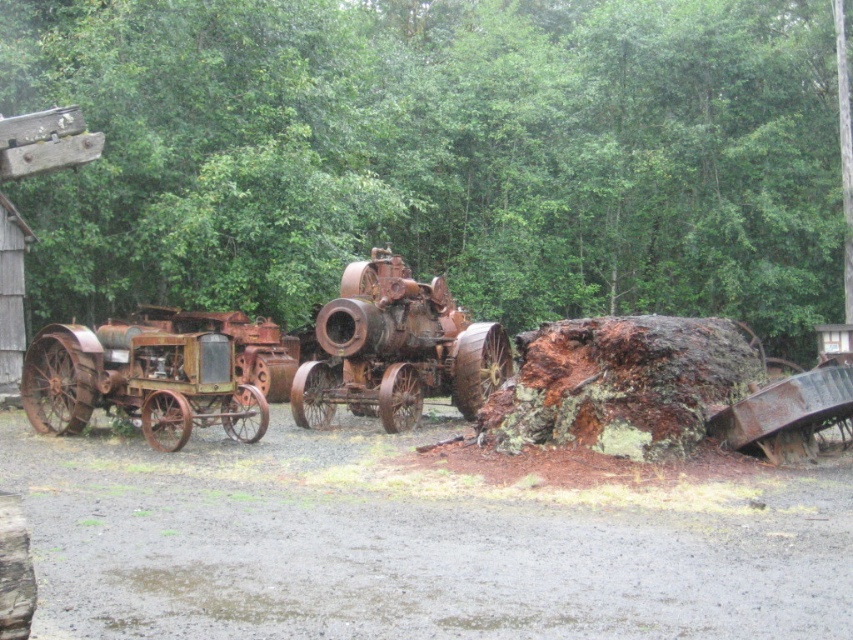
Question: Can you confirm if green leafy tree at upper center is positioned to the left of rusty metal tractor at left?

Choices:
 (A) yes
 (B) no

Answer: (B)

Question: Is green leafy tree at upper center to the left of rusty metal tractor at left from the viewer's perspective?

Choices:
 (A) yes
 (B) no

Answer: (B)

Question: Does green leafy tree at upper center come in front of rusty metal tractor at left?

Choices:
 (A) no
 (B) yes

Answer: (B)

Question: Which point is closer to the camera?

Choices:
 (A) (462, 337)
 (B) (811, 211)

Answer: (A)

Question: Which object is farther from the camera taking this photo?

Choices:
 (A) rusty metal tractor at center
 (B) rusty metal tractor at left
 (C) green leafy tree at upper center

Answer: (A)

Question: Which is nearer to the rusty metal tractor at center?

Choices:
 (A) green leafy tree at upper center
 (B) rusty metal tractor at left

Answer: (B)